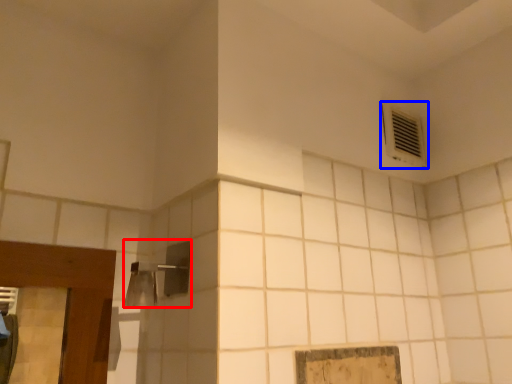
Question: Which of the following is the farthest to the observer, shower (highlighted by a red box) or air conditioning (highlighted by a blue box)?

Choices:
 (A) shower
 (B) air conditioning

Answer: (B)